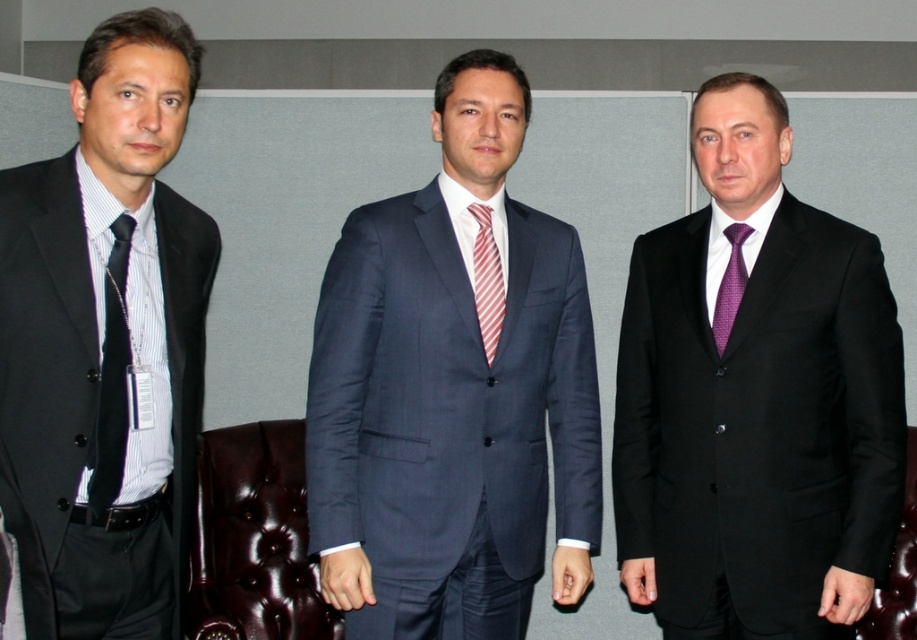
Question: Is matte black suit at center below black silk tie at left?

Choices:
 (A) yes
 (B) no

Answer: (A)

Question: Estimate the real-world distances between objects in this image. Which object is farther from the navy blue suit at center?

Choices:
 (A) leather at center
 (B) matte black suit at left
 (C) black silk tie at left

Answer: (A)

Question: Which object is farther from the camera taking this photo?

Choices:
 (A) black silk tie at left
 (B) brown leather armchair at center
 (C) red striped tie at center

Answer: (B)

Question: Which point is farther to the camera?

Choices:
 (A) matte black suit at center
 (B) brown leather armchair at center
 (C) leather at center

Answer: (C)

Question: Is navy blue suit at center positioned before brown leather armchair at center?

Choices:
 (A) yes
 (B) no

Answer: (A)

Question: Is matte black suit at center positioned before leather at center?

Choices:
 (A) no
 (B) yes

Answer: (B)